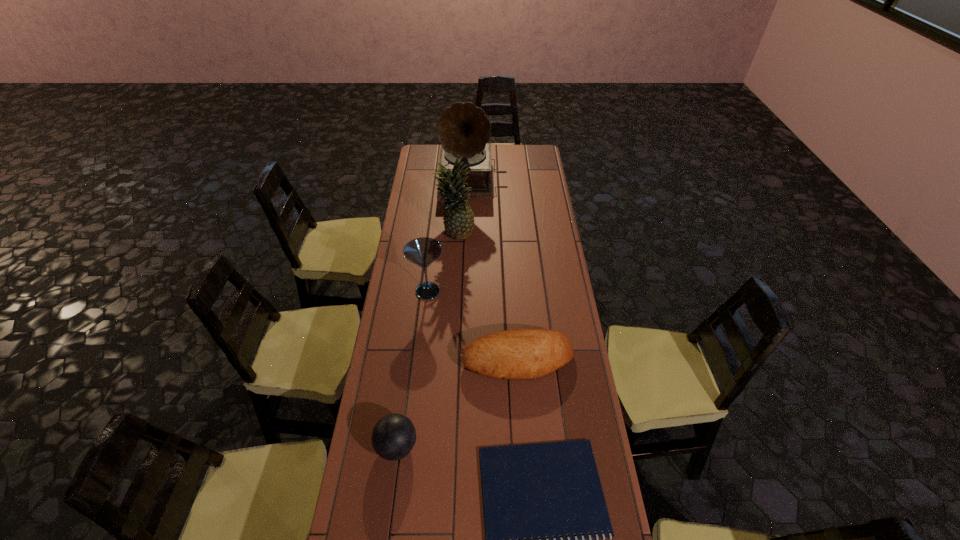
Where is `blank area in the image that satisfies the following two spatial constraints: 1. on the front side of the second shortest object; 2. on the grip area of the bowling ball`? The image size is (960, 540). blank area in the image that satisfies the following two spatial constraints: 1. on the front side of the second shortest object; 2. on the grip area of the bowling ball is located at coordinates (523, 446).